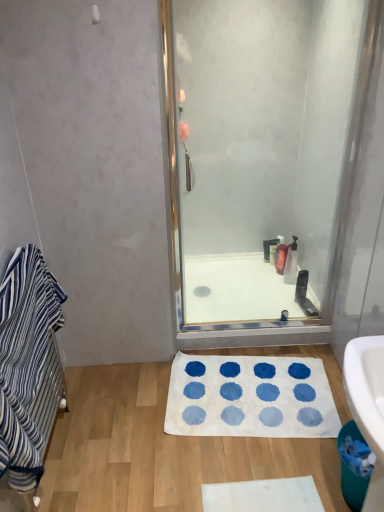
This screenshot has width=384, height=512. Identify the location of white soft bath mat at center. (250, 397).

You are a GUI agent. You are given a task and a screenshot of the screen. Output one action in this format:
    pyautogui.click(x=<x>, y=<y>)
    Task: Click on the white glossy bath at center
    This screenshot has height=512, width=384.
    Given the screenshot: What is the action you would take?
    pyautogui.click(x=236, y=290)

Where is `translucent plastic soap dispenser at center, arranged as the 2th toiletry when viewed from the back`? This screenshot has height=512, width=384. translucent plastic soap dispenser at center, arranged as the 2th toiletry when viewed from the back is located at coordinates (281, 256).

Describe the element at coordinates (278, 249) in the screenshot. I see `translucent plastic soap dispenser at center, placed as the first toiletry when sorted from back to front` at that location.

Locate an element on the screen. The width and height of the screenshot is (384, 512). transparent glass shower door at center is located at coordinates (263, 162).

This screenshot has height=512, width=384. What do you see at coordinates (263, 162) in the screenshot?
I see `transparent glass shower door at center` at bounding box center [263, 162].

How much space does black plastic razor at lower right, arranged as the 1th toiletry when viewed from the front, occupy vertically?

The height of black plastic razor at lower right, arranged as the 1th toiletry when viewed from the front, is 6.94 inches.

The width and height of the screenshot is (384, 512). I want to click on translucent plastic bottle at upper right, marked as the second toiletry in a front-to-back arrangement, so click(x=291, y=263).

Where is `white soft bath mat at center`? The image size is (384, 512). white soft bath mat at center is located at coordinates (250, 397).

From the image's perspective, does transparent glass shower door at center appear lower than translucent plastic bottle at upper right, which ranks as the third toiletry in back-to-front order?

No.

Considering the relative sizes of transparent glass shower door at center and translucent plastic bottle at upper right, which ranks as the third toiletry in back-to-front order, in the image provided, is transparent glass shower door at center wider than translucent plastic bottle at upper right, which ranks as the third toiletry in back-to-front order,?

In fact, transparent glass shower door at center might be narrower than translucent plastic bottle at upper right, which ranks as the third toiletry in back-to-front order.

Does transparent glass shower door at center touch translucent plastic bottle at upper right, which ranks as the third toiletry in back-to-front order?

transparent glass shower door at center is not next to translucent plastic bottle at upper right, which ranks as the third toiletry in back-to-front order, and they're not touching.

From the transparent glass shower door at center, count 4th toiletry to the right and point to it. Please provide its 2D coordinates.

[(291, 263)]

Is white soft bath mat at center positioned beyond the bounds of black plastic razor at lower right, arranged as the 4th toiletry when viewed from the back?

Yes.

Considering the relative positions of white soft bath mat at center and black plastic razor at lower right, arranged as the 1th toiletry when viewed from the front, in the image provided, is white soft bath mat at center to the right of black plastic razor at lower right, arranged as the 1th toiletry when viewed from the front, from the viewer's perspective?

Incorrect, white soft bath mat at center is not on the right side of black plastic razor at lower right, arranged as the 1th toiletry when viewed from the front.

From a real-world perspective, is white soft bath mat at center positioned above or below black plastic razor at lower right, arranged as the 1th toiletry when viewed from the front?

From a real-world perspective, white soft bath mat at center is physically below black plastic razor at lower right, arranged as the 1th toiletry when viewed from the front.

Can you confirm if white soft bath mat at center is smaller than black plastic razor at lower right, arranged as the 1th toiletry when viewed from the front?

No, white soft bath mat at center is not smaller than black plastic razor at lower right, arranged as the 1th toiletry when viewed from the front.

Consider the image. Which is further, (209, 357) or (184, 189)?

Point (209, 357)

Are white soft bath mat at center and transparent glass shower door at center beside each other?

There is a gap between white soft bath mat at center and transparent glass shower door at center.

Is white soft bath mat at center taller than transparent glass shower door at center?

No, white soft bath mat at center is not taller than transparent glass shower door at center.

In terms of width, does white soft bath mat at center look wider or thinner when compared to transparent glass shower door at center?

Clearly, white soft bath mat at center has more width compared to transparent glass shower door at center.

Based on the photo, does translucent plastic soap dispenser at center, placed as the first toiletry when sorted from back to front, have a greater height compared to blue striped towel at left?

Incorrect, the height of translucent plastic soap dispenser at center, placed as the first toiletry when sorted from back to front, is not larger of that of blue striped towel at left.

Which object is closer to the camera, translucent plastic soap dispenser at center, placed as the 4th toiletry when sorted from front to back, or blue striped towel at left?

blue striped towel at left is more forward.

From the picture: Can you confirm if translucent plastic soap dispenser at center, placed as the first toiletry when sorted from back to front, is bigger than blue striped towel at left?

No.

Is translucent plastic soap dispenser at center, placed as the 4th toiletry when sorted from front to back, not inside blue striped towel at left?

Absolutely, translucent plastic soap dispenser at center, placed as the 4th toiletry when sorted from front to back, is external to blue striped towel at left.

Does translucent plastic soap dispenser at center, placed as the first toiletry when sorted from back to front, have a larger size compared to white soft bath mat at center?

No, translucent plastic soap dispenser at center, placed as the first toiletry when sorted from back to front, is not bigger than white soft bath mat at center.

How different are the orientations of translucent plastic soap dispenser at center, placed as the first toiletry when sorted from back to front, and white soft bath mat at center in degrees?

81.4 degrees separate the facing orientations of translucent plastic soap dispenser at center, placed as the first toiletry when sorted from back to front, and white soft bath mat at center.

From a real-world perspective, is translucent plastic soap dispenser at center, placed as the first toiletry when sorted from back to front, over white soft bath mat at center?

Yes, from a real-world perspective, translucent plastic soap dispenser at center, placed as the first toiletry when sorted from back to front, is over white soft bath mat at center

Which object is positioned more to the left, translucent plastic soap dispenser at center, placed as the 4th toiletry when sorted from front to back, or white soft bath mat at center?

From the viewer's perspective, white soft bath mat at center appears more on the left side.

Considering the relative sizes of translucent plastic soap dispenser at center, arranged as the 2th toiletry when viewed from the back, and translucent plastic soap dispenser at center, placed as the 4th toiletry when sorted from front to back, in the image provided, is translucent plastic soap dispenser at center, arranged as the 2th toiletry when viewed from the back, bigger than translucent plastic soap dispenser at center, placed as the 4th toiletry when sorted from front to back,?

Yes, translucent plastic soap dispenser at center, arranged as the 2th toiletry when viewed from the back, is bigger than translucent plastic soap dispenser at center, placed as the 4th toiletry when sorted from front to back.

From the image's perspective, between translucent plastic soap dispenser at center, arranged as the 2th toiletry when viewed from the back, and translucent plastic soap dispenser at center, placed as the 4th toiletry when sorted from front to back, which one is located above?

translucent plastic soap dispenser at center, placed as the 4th toiletry when sorted from front to back.

From a real-world perspective, is translucent plastic soap dispenser at center, the third toiletry in the front-to-back sequence, under translucent plastic soap dispenser at center, placed as the first toiletry when sorted from back to front?

Yes, from a real-world perspective, translucent plastic soap dispenser at center, the third toiletry in the front-to-back sequence, is beneath translucent plastic soap dispenser at center, placed as the first toiletry when sorted from back to front.

Would you say translucent plastic soap dispenser at center, arranged as the 2th toiletry when viewed from the back, is a long distance from translucent plastic soap dispenser at center, placed as the 4th toiletry when sorted from front to back?

No, translucent plastic soap dispenser at center, arranged as the 2th toiletry when viewed from the back, is not far away from translucent plastic soap dispenser at center, placed as the 4th toiletry when sorted from front to back.

From a real-world perspective, relative to white soft bath mat at center, is black plastic razor at lower right, arranged as the 4th toiletry when viewed from the back, vertically above or below?

black plastic razor at lower right, arranged as the 4th toiletry when viewed from the back, is above white soft bath mat at center.

Which object is thinner, black plastic razor at lower right, arranged as the 4th toiletry when viewed from the back, or white soft bath mat at center?

black plastic razor at lower right, arranged as the 4th toiletry when viewed from the back.

Which is correct: black plastic razor at lower right, arranged as the 1th toiletry when viewed from the front, is inside white soft bath mat at center, or outside of it?

black plastic razor at lower right, arranged as the 1th toiletry when viewed from the front, is located beyond the bounds of white soft bath mat at center.

Considering the sizes of objects black plastic razor at lower right, arranged as the 4th toiletry when viewed from the back, and white soft bath mat at center in the image provided, who is shorter, black plastic razor at lower right, arranged as the 4th toiletry when viewed from the back, or white soft bath mat at center?

white soft bath mat at center is shorter.

From the image's perspective, which toiletry is the 3rd one below the transparent glass shower door at center? Please provide its 2D coordinates.

[(291, 263)]

The width and height of the screenshot is (384, 512). What are the coordinates of `bath mat lying on the left of black plastic razor at lower right, arranged as the 1th toiletry when viewed from the front` in the screenshot? It's located at (250, 397).

Estimate the real-world distances between objects in this image. Which object is further from black plastic razor at lower right, arranged as the 1th toiletry when viewed from the front, translucent plastic soap dispenser at center, placed as the first toiletry when sorted from back to front, or transparent glass shower door at center?

transparent glass shower door at center lies further to black plastic razor at lower right, arranged as the 1th toiletry when viewed from the front, than the other object.

In the scene shown: Which object lies nearer to the anchor point black plastic razor at lower right, arranged as the 4th toiletry when viewed from the back, white soft bath mat at center or translucent plastic soap dispenser at center, placed as the first toiletry when sorted from back to front?

translucent plastic soap dispenser at center, placed as the first toiletry when sorted from back to front, is closer to black plastic razor at lower right, arranged as the 4th toiletry when viewed from the back.

Considering their positions, is translucent plastic soap dispenser at center, the third toiletry in the front-to-back sequence, positioned closer to translucent plastic bottle at upper right, which ranks as the third toiletry in back-to-front order, than black plastic razor at lower right, arranged as the 4th toiletry when viewed from the back?

black plastic razor at lower right, arranged as the 4th toiletry when viewed from the back, is positioned closer to the anchor translucent plastic bottle at upper right, which ranks as the third toiletry in back-to-front order.

Which object lies nearer to the anchor point blue striped towel at left, translucent plastic soap dispenser at center, the third toiletry in the front-to-back sequence, or transparent glass shower door at center?

transparent glass shower door at center lies closer to blue striped towel at left than the other object.

From the image, which object appears to be farther from white glossy bath at center, transparent glass shower door at center or translucent plastic bottle at upper right, which ranks as the third toiletry in back-to-front order?

transparent glass shower door at center is positioned further to the anchor white glossy bath at center.

Based on their spatial positions, is white soft bath mat at center or translucent plastic soap dispenser at center, placed as the 4th toiletry when sorted from front to back, further from transparent glass shower door at center?

The object further to transparent glass shower door at center is white soft bath mat at center.

Based on their spatial positions, is transparent glass shower door at center or white soft bath mat at center closer to black plastic razor at lower right, arranged as the 1th toiletry when viewed from the front?

white soft bath mat at center is positioned closer to the anchor black plastic razor at lower right, arranged as the 1th toiletry when viewed from the front.

Looking at the image, which one is located further to transparent glass shower door at center, translucent plastic soap dispenser at center, placed as the first toiletry when sorted from back to front, or blue striped towel at left?

The object further to transparent glass shower door at center is blue striped towel at left.

At what (x,y) coordinates should I click in order to perform the action: click on bath mat positioned between transparent glass shower door at center and translucent plastic soap dispenser at center, placed as the first toiletry when sorted from back to front, from near to far. Please return your answer as a coordinate pair (x, y). The width and height of the screenshot is (384, 512). Looking at the image, I should click on (250, 397).

Locate an element on the screen. toiletry between black plastic razor at lower right, arranged as the 4th toiletry when viewed from the back, and translucent plastic soap dispenser at center, arranged as the 2th toiletry when viewed from the back, in the front-back direction is located at coordinates (291, 263).

Identify the location of bath mat between blue striped towel at left and transparent glass shower door at center. (250, 397).

Identify the location of bath mat positioned between blue striped towel at left and translucent plastic soap dispenser at center, the third toiletry in the front-to-back sequence, from near to far. (250, 397).